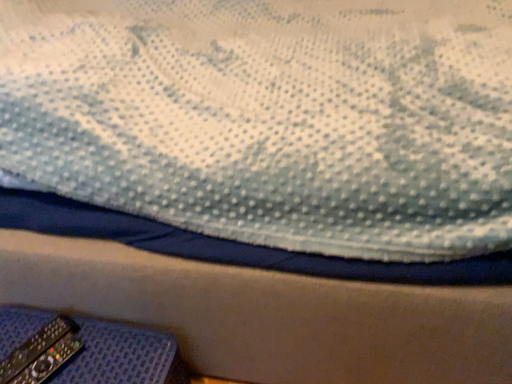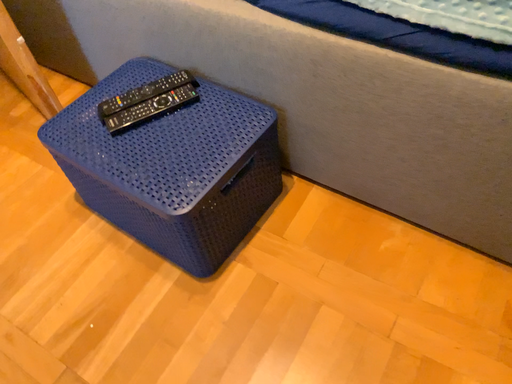
Question: How did the camera likely rotate when shooting the video?

Choices:
 (A) rotated upward
 (B) rotated downward

Answer: (B)